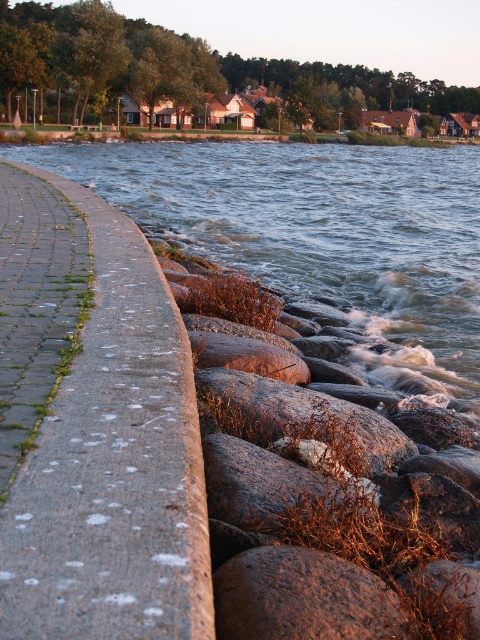
Does concrete at left appear under granite rock at lower center?

No.

Describe the element at coordinates (112, 465) in the screenshot. I see `concrete at left` at that location.

The image size is (480, 640). Find the location of `concrete at left`. concrete at left is located at coordinates (112, 465).

Between clear water at lower right and smooth concrete curb at center, which one appears on the right side from the viewer's perspective?

clear water at lower right is more to the right.

Can you confirm if clear water at lower right is wider than smooth concrete curb at center?

Indeed, clear water at lower right has a greater width compared to smooth concrete curb at center.

The width and height of the screenshot is (480, 640). What do you see at coordinates (322, 236) in the screenshot?
I see `clear water at lower right` at bounding box center [322, 236].

Where is `clear water at lower right`? clear water at lower right is located at coordinates (322, 236).

Does brown rough stone at lower center have a lesser width compared to smooth concrete curb at center?

Yes, brown rough stone at lower center is thinner than smooth concrete curb at center.

Is brown rough stone at lower center to the right of smooth concrete curb at center from the viewer's perspective?

Indeed, brown rough stone at lower center is positioned on the right side of smooth concrete curb at center.

Identify the location of brown rough stone at lower center. This screenshot has height=640, width=480. (302, 596).

You are a GUI agent. You are given a task and a screenshot of the screen. Output one action in this format:
    pyautogui.click(x=<x>, y=<y>)
    Task: Click on the brown rough stone at lower center
    
    Given the screenshot: What is the action you would take?
    pyautogui.click(x=302, y=596)